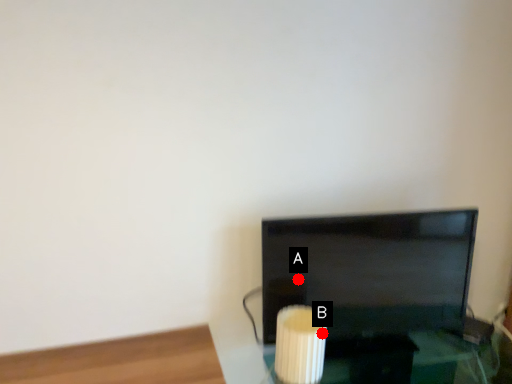
Question: Two points are circled on the image, labeled by A and B beside each circle. Which point is closer to the camera taking this photo?

Choices:
 (A) A is closer
 (B) B is closer

Answer: (B)